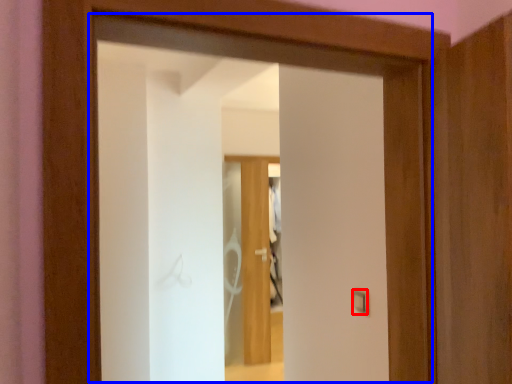
Question: Which object appears closest to the camera in this image, light switch (highlighted by a red box) or door (highlighted by a blue box)?

Choices:
 (A) light switch
 (B) door

Answer: (B)